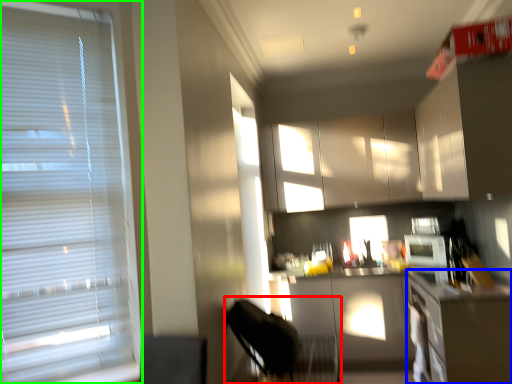
Question: Which is nearer to the swivel chair (highlighted by a red box)? counter top (highlighted by a blue box) or window blind (highlighted by a green box).

Choices:
 (A) counter top
 (B) window blind

Answer: (A)